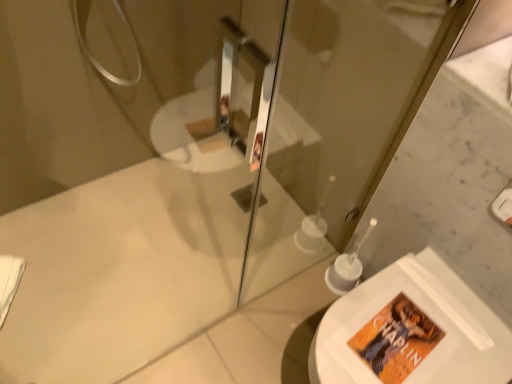
Locate an element on the screen. The height and width of the screenshot is (384, 512). free location above white glossy toilet at lower right (from a real-world perspective) is located at coordinates (399, 332).